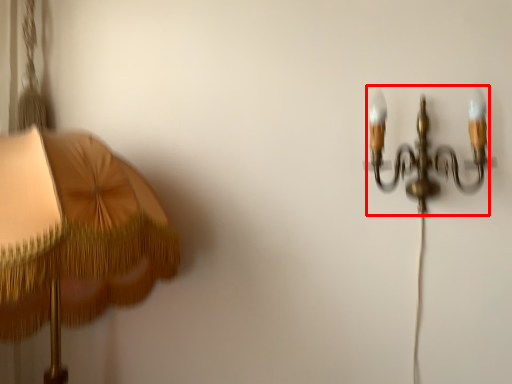
Question: Considering the relative positions of lamp (annotated by the red box) and lamp in the image provided, where is lamp (annotated by the red box) located with respect to the staircase?

Choices:
 (A) left
 (B) right

Answer: (B)